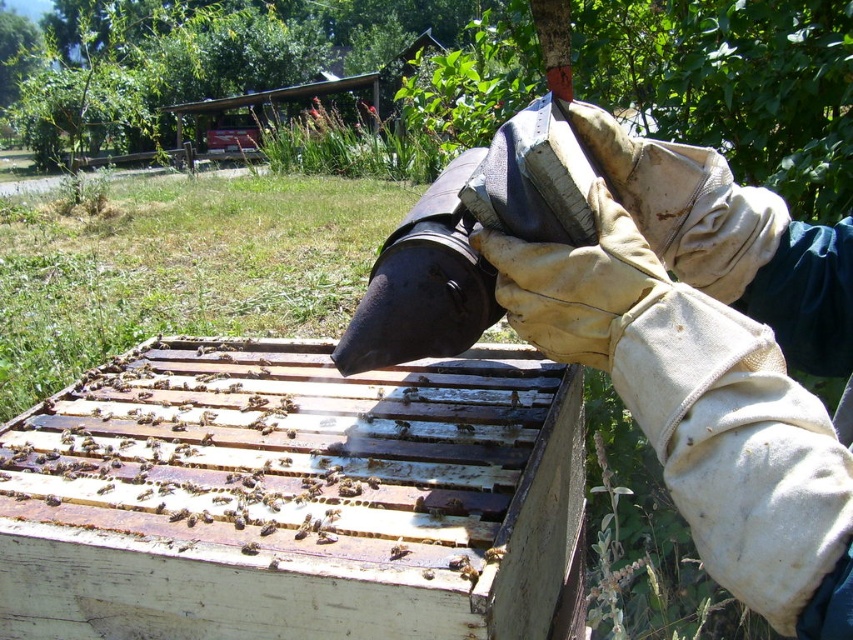
Question: Which of the following is the farthest from the observer?

Choices:
 (A) (515, 404)
 (B) (740, 243)
 (C) (39, 634)

Answer: (A)

Question: Which point appears closest to the camera in this image?

Choices:
 (A) (509, 394)
 (B) (471, 426)

Answer: (B)

Question: Where is white cotton gloves at upper right located in relation to translucent brown honeycomb at center in the image?

Choices:
 (A) right
 (B) left

Answer: (A)

Question: Is white cotton gloves at upper right to the left of translucent plastic bee at center from the viewer's perspective?

Choices:
 (A) yes
 (B) no

Answer: (B)

Question: From the image, what is the correct spatial relationship of white cotton gloves at upper right in relation to translucent plastic bee at center?

Choices:
 (A) below
 (B) above

Answer: (B)

Question: Which object is positioned closest to the wooden beehive at center?

Choices:
 (A) white cotton gloves at upper right
 (B) translucent plastic bee at center

Answer: (B)